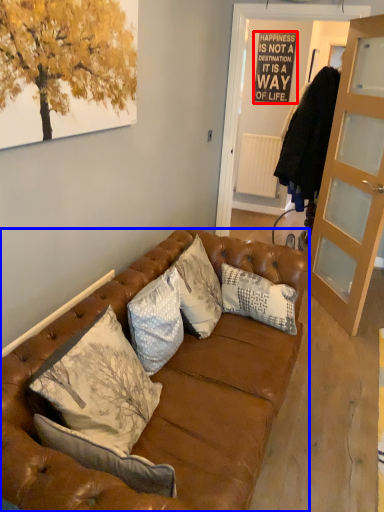
Question: Among these objects, which one is nearest to the camera, bulletin board (highlighted by a red box) or studio couch (highlighted by a blue box)?

Choices:
 (A) bulletin board
 (B) studio couch

Answer: (B)